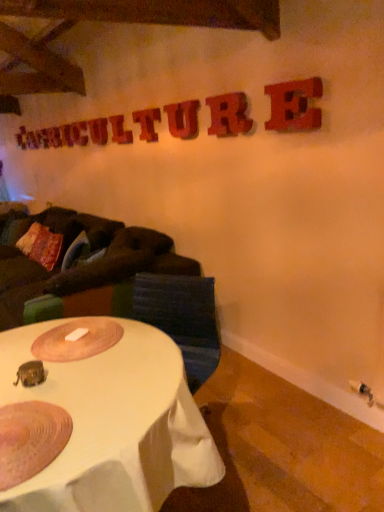
Question: Can you confirm if textured multicolored pillow at left is taller than rusty metal letter e at upper right, the 1th letter viewed from the right?

Choices:
 (A) yes
 (B) no

Answer: (A)

Question: Could you tell me if textured multicolored pillow at left is turned towards rusty metal letter e at upper right, marked as the 8th letter in a back-to-front arrangement?

Choices:
 (A) no
 (B) yes

Answer: (A)

Question: Does textured multicolored pillow at left have a greater width compared to rusty metal letter e at upper right, the 1th letter viewed from the right?

Choices:
 (A) yes
 (B) no

Answer: (A)

Question: Considering the relative sizes of textured multicolored pillow at left and rusty metal letter e at upper right, the 1th letter positioned from the front, in the image provided, is textured multicolored pillow at left smaller than rusty metal letter e at upper right, the 1th letter positioned from the front,?

Choices:
 (A) yes
 (B) no

Answer: (B)

Question: From a real-world perspective, does textured multicolored pillow at left stand above rusty metal letter e at upper right, the 1th letter viewed from the right?

Choices:
 (A) no
 (B) yes

Answer: (A)

Question: From a real-world perspective, is wooden sign at upper center, the second letter when ordered from left to right, positioned above or below textured fabric swivel chair at center?

Choices:
 (A) above
 (B) below

Answer: (A)

Question: In the image, is wooden sign at upper center, which appears as the second letter when viewed from the back, on the left side or the right side of textured fabric swivel chair at center?

Choices:
 (A) right
 (B) left

Answer: (B)

Question: Is wooden sign at upper center, the 7th letter viewed from the right, taller or shorter than textured fabric swivel chair at center?

Choices:
 (A) tall
 (B) short

Answer: (B)

Question: Is wooden sign at upper center, acting as the seventh letter starting from the front, in front of or behind textured fabric swivel chair at center in the image?

Choices:
 (A) behind
 (B) front

Answer: (A)

Question: In terms of height, does white glossy table at lower left look taller or shorter compared to textured fabric swivel chair at center?

Choices:
 (A) short
 (B) tall

Answer: (B)

Question: From the image's perspective, is white glossy table at lower left above or below textured fabric swivel chair at center?

Choices:
 (A) above
 (B) below

Answer: (B)

Question: Relative to textured fabric swivel chair at center, is white glossy table at lower left in front or behind?

Choices:
 (A) behind
 (B) front

Answer: (B)

Question: Based on their sizes in the image, would you say white glossy table at lower left is bigger or smaller than textured fabric swivel chair at center?

Choices:
 (A) big
 (B) small

Answer: (A)

Question: Considering the positions of wooden sign at upper center, the second letter when ordered from left to right, and dark brown fabric couch at left in the image, is wooden sign at upper center, the second letter when ordered from left to right, wider or thinner than dark brown fabric couch at left?

Choices:
 (A) thin
 (B) wide

Answer: (A)

Question: From the image's perspective, is wooden sign at upper center, the second letter when ordered from left to right, positioned above or below dark brown fabric couch at left?

Choices:
 (A) below
 (B) above

Answer: (B)